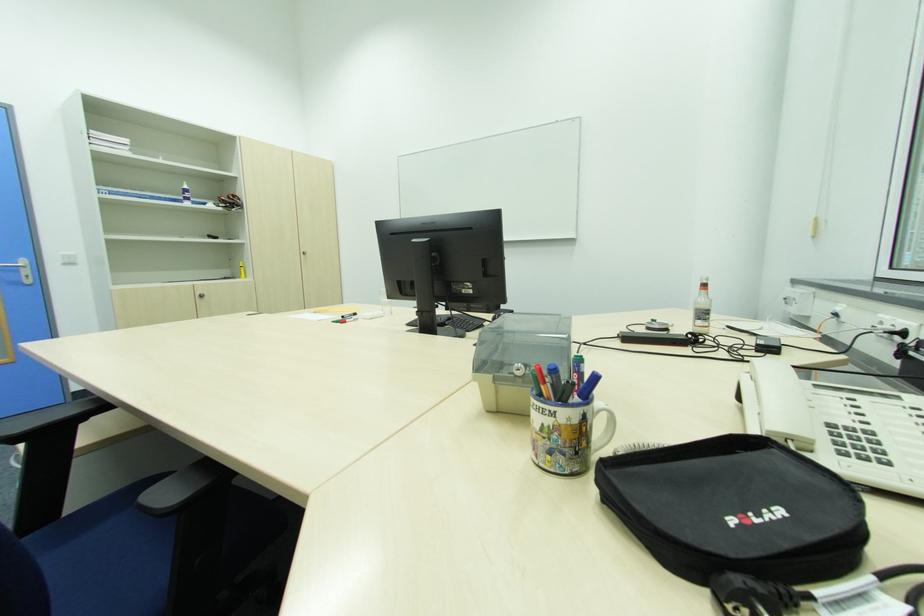
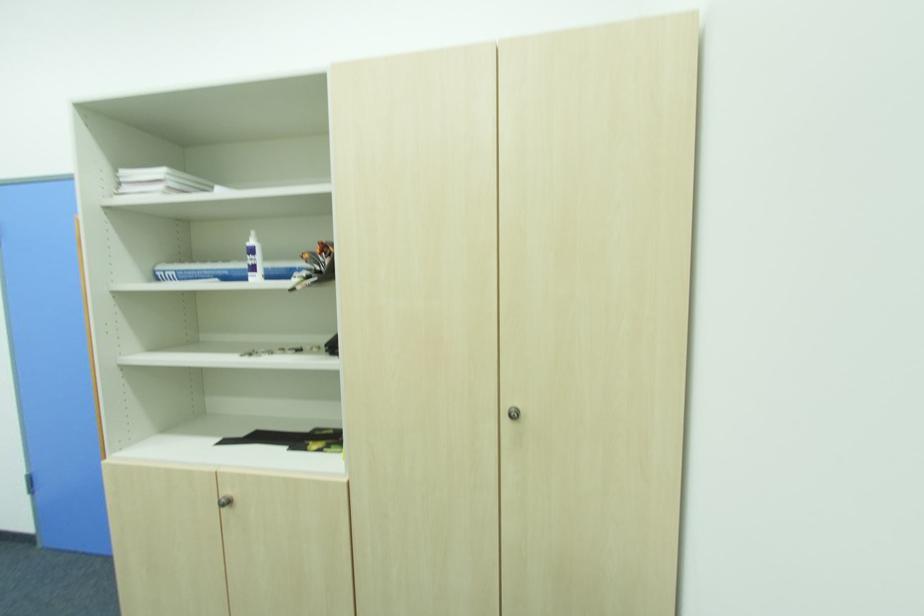
Locate, in the second image, the point that corresponds to pixel 188 188 in the first image.

(254, 243)